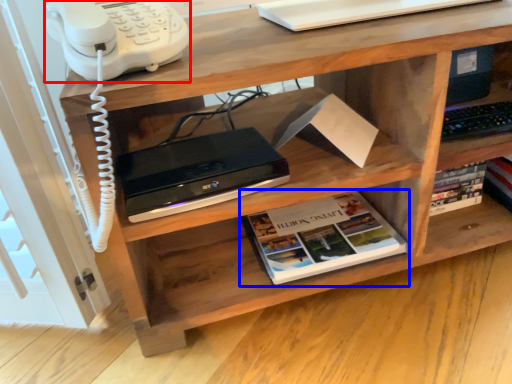
Question: Which of the following is the closest to the observer, corded phone (highlighted by a red box) or book (highlighted by a blue box)?

Choices:
 (A) corded phone
 (B) book

Answer: (A)